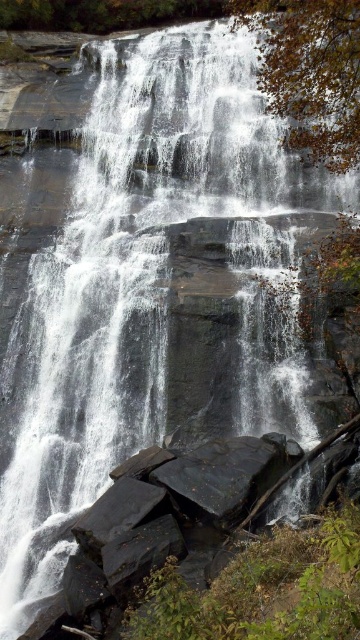
Does black smooth rock at center have a greater width compared to dark gray rock at lower center?

Yes.

Does black smooth rock at center have a greater height compared to dark gray rock at lower center?

Yes, black smooth rock at center is taller than dark gray rock at lower center.

Between point (182, 500) and point (123, 570), which one is positioned behind?

Positioned behind is point (182, 500).

Where is `black smooth rock at center`? black smooth rock at center is located at coordinates (222, 476).

Between dark gray rock at lower center and black smooth rock at lower center, which one is positioned higher?

Positioned higher is black smooth rock at lower center.

Does dark gray rock at lower center appear on the left side of black smooth rock at lower center?

In fact, dark gray rock at lower center is to the right of black smooth rock at lower center.

Locate an element on the screen. dark gray rock at lower center is located at coordinates (140, 554).

Consider the image. Is black smooth rock at center to the right of black smooth rock at lower center from the viewer's perspective?

Correct, you'll find black smooth rock at center to the right of black smooth rock at lower center.

Between black smooth rock at center and black smooth rock at lower center, which one has more height?

Standing taller between the two is black smooth rock at center.

Find the location of a particular element. The height and width of the screenshot is (640, 360). black smooth rock at center is located at coordinates (222, 476).